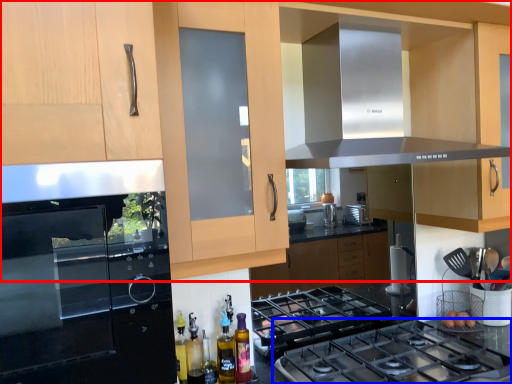
Question: Which of the following is the closest to the observer, cabinetry (highlighted by a red box) or gas stove (highlighted by a blue box)?

Choices:
 (A) cabinetry
 (B) gas stove

Answer: (A)